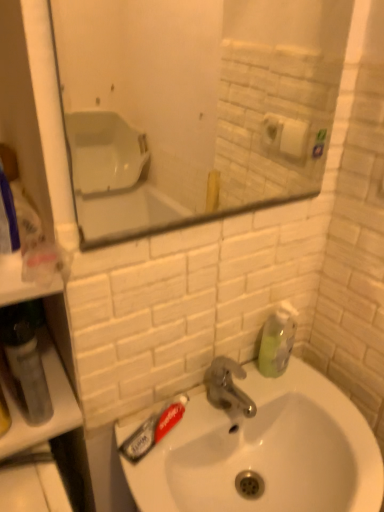
Question: Is green translucent soap dispenser at right shorter than matte glass mirror at upper center?

Choices:
 (A) yes
 (B) no

Answer: (A)

Question: Considering the relative sizes of green translucent soap dispenser at right and matte glass mirror at upper center in the image provided, is green translucent soap dispenser at right thinner than matte glass mirror at upper center?

Choices:
 (A) yes
 (B) no

Answer: (B)

Question: Is green translucent soap dispenser at right oriented towards matte glass mirror at upper center?

Choices:
 (A) no
 (B) yes

Answer: (A)

Question: Does green translucent soap dispenser at right touch matte glass mirror at upper center?

Choices:
 (A) yes
 (B) no

Answer: (B)

Question: Does green translucent soap dispenser at right have a smaller size compared to matte glass mirror at upper center?

Choices:
 (A) no
 (B) yes

Answer: (B)

Question: Do you think matte glass mirror at upper center is within white glossy sink at center, or outside of it?

Choices:
 (A) outside
 (B) inside

Answer: (A)

Question: In terms of height, does matte glass mirror at upper center look taller or shorter compared to white glossy sink at center?

Choices:
 (A) tall
 (B) short

Answer: (A)

Question: Would you say matte glass mirror at upper center is to the left or to the right of white glossy sink at center in the picture?

Choices:
 (A) left
 (B) right

Answer: (A)

Question: From the image's perspective, is matte glass mirror at upper center located above or below white glossy sink at center?

Choices:
 (A) below
 (B) above

Answer: (B)

Question: In terms of width, does matte glass mirror at upper center look wider or thinner when compared to translucent plastic mouthwash at left?

Choices:
 (A) wide
 (B) thin

Answer: (B)

Question: Considering the positions of matte glass mirror at upper center and translucent plastic mouthwash at left in the image, is matte glass mirror at upper center bigger or smaller than translucent plastic mouthwash at left?

Choices:
 (A) small
 (B) big

Answer: (B)

Question: From the image's perspective, is matte glass mirror at upper center located above or below translucent plastic mouthwash at left?

Choices:
 (A) below
 (B) above

Answer: (B)

Question: Relative to translucent plastic mouthwash at left, is matte glass mirror at upper center in front or behind?

Choices:
 (A) behind
 (B) front

Answer: (B)

Question: Looking at their shapes, would you say translucent plastic toothpaste at sink left is wider or thinner than matte glass mirror at upper center?

Choices:
 (A) wide
 (B) thin

Answer: (A)

Question: From the image's perspective, is translucent plastic toothpaste at sink left located above or below matte glass mirror at upper center?

Choices:
 (A) below
 (B) above

Answer: (A)